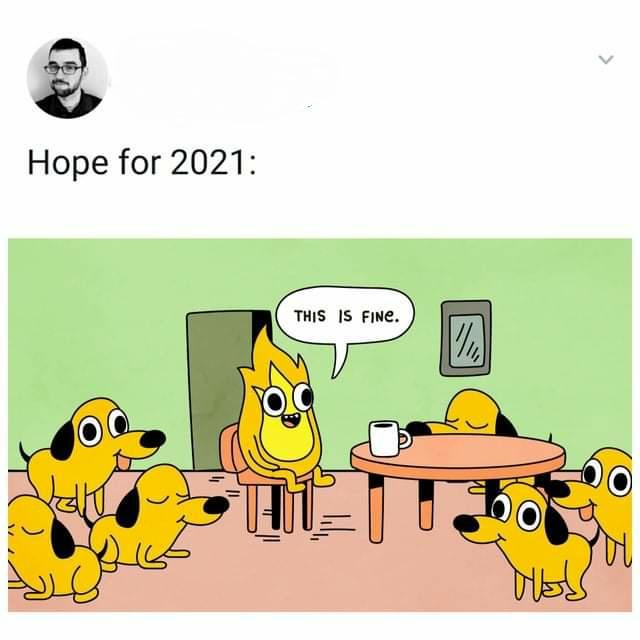
Identify the location of peach colored table top. The width and height of the screenshot is (640, 640). (450, 447).